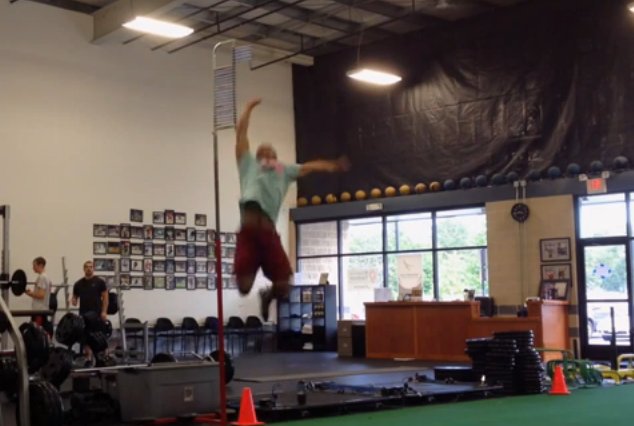
You are a GUI agent. You are given a task and a screenshot of the screen. Output one action in this format:
    pyautogui.click(x=<x>, y=<y>)
    Task: Click on the assortment of framed pictures on the wall
    
    Given the screenshot: What is the action you would take?
    pyautogui.click(x=155, y=249)